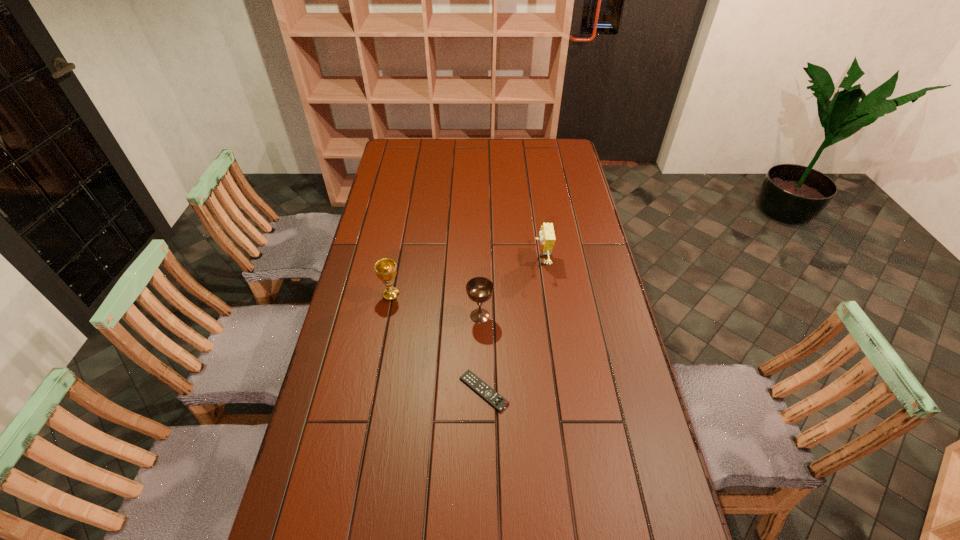
Identify the location of vacant area that lies between the rightmost object and the second farthest object. This screenshot has width=960, height=540. click(467, 278).

Find the location of a particular element. The image size is (960, 540). free area in between the sponge and the nearer chalice is located at coordinates pyautogui.click(x=511, y=288).

The image size is (960, 540). Identify the location of blank region between the leftmost object and the nearest object. (438, 343).

Locate an element on the screen. free space between the second farthest object and the third farthest object is located at coordinates (436, 306).

At what (x,y) coordinates should I click in order to perform the action: click on free space between the right chalice and the shortest object. Please return your answer as a coordinate pair (x, y). The width and height of the screenshot is (960, 540). Looking at the image, I should click on (482, 354).

At what (x,y) coordinates should I click in order to perform the action: click on free area in between the second nearest object and the remote control. Please return your answer as a coordinate pair (x, y). Image resolution: width=960 pixels, height=540 pixels. Looking at the image, I should click on pos(482,354).

Find the location of a particular element. This screenshot has height=540, width=960. empty location between the second farthest object and the farthest object is located at coordinates (467, 278).

At what (x,y) coordinates should I click in order to perform the action: click on empty space that is in between the nearer chalice and the nearest object. Please return your answer as a coordinate pair (x, y). Looking at the image, I should click on (482, 354).

At what (x,y) coordinates should I click in order to perform the action: click on free space between the nearest object and the right chalice. Please return your answer as a coordinate pair (x, y). Looking at the image, I should click on (482, 354).

Where is `object that is the closest to the third farthest object`? Image resolution: width=960 pixels, height=540 pixels. object that is the closest to the third farthest object is located at coordinates (469, 378).